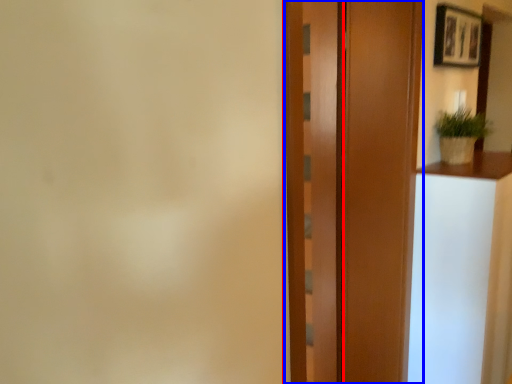
Question: Which of the following is the farthest to the observer, barn door (highlighted by a red box) or door (highlighted by a blue box)?

Choices:
 (A) barn door
 (B) door

Answer: (A)